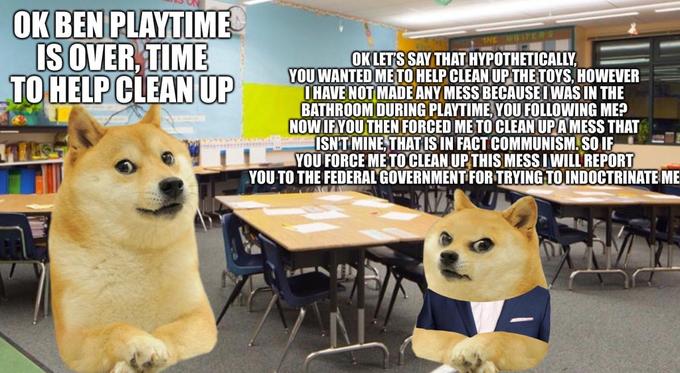
The image size is (680, 373). In order to click on ceiling light in this screenshot , I will do `click(564, 18)`, `click(258, 0)`.